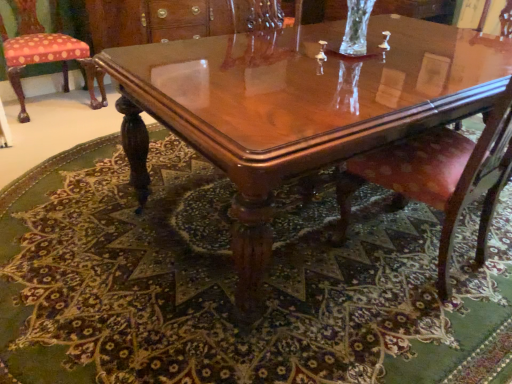
Question: From the image's perspective, is polka dot fabric cushion at left, the 2th chair from the front, beneath pink velvet chair at center, which appears as the 2th chair when viewed from the top?

Choices:
 (A) no
 (B) yes

Answer: (A)

Question: Considering the relative positions of polka dot fabric cushion at left, marked as the 1th chair in a top-to-bottom arrangement, and pink velvet chair at center, which appears as the 2th chair when viewed from the top, in the image provided, is polka dot fabric cushion at left, marked as the 1th chair in a top-to-bottom arrangement, behind pink velvet chair at center, which appears as the 2th chair when viewed from the top,?

Choices:
 (A) yes
 (B) no

Answer: (A)

Question: Is polka dot fabric cushion at left, the 2th chair from the front, taller than pink velvet chair at center, acting as the first chair starting from the front?

Choices:
 (A) no
 (B) yes

Answer: (A)

Question: Is pink velvet chair at center, arranged as the 1th chair when ordered from the bottom, inside polka dot fabric cushion at left, which ranks as the second chair in right-to-left order?

Choices:
 (A) no
 (B) yes

Answer: (A)

Question: Is polka dot fabric cushion at left, which ranks as the second chair in right-to-left order, located outside pink velvet chair at center, arranged as the 1th chair when ordered from the bottom?

Choices:
 (A) yes
 (B) no

Answer: (A)

Question: Is pink velvet chair at center, acting as the second chair starting from the left, wider or thinner than polka dot fabric cushion at left, which appears as the 2th chair when ordered from the bottom?

Choices:
 (A) wide
 (B) thin

Answer: (A)

Question: Is pink velvet chair at center, placed as the second chair when sorted from back to front, inside the boundaries of polka dot fabric cushion at left, the 2th chair from the front, or outside?

Choices:
 (A) inside
 (B) outside

Answer: (B)

Question: Is pink velvet chair at center, placed as the second chair when sorted from back to front, in front of or behind polka dot fabric cushion at left, the 1th chair in the back-to-front sequence, in the image?

Choices:
 (A) front
 (B) behind

Answer: (A)

Question: Based on their sizes in the image, would you say pink velvet chair at center, acting as the first chair starting from the front, is bigger or smaller than polka dot fabric cushion at left, the 1th chair in the back-to-front sequence?

Choices:
 (A) small
 (B) big

Answer: (B)

Question: Looking at the image, does carpeted floor at center seem bigger or smaller compared to polka dot fabric cushion at left, marked as the 1th chair in a top-to-bottom arrangement?

Choices:
 (A) small
 (B) big

Answer: (B)

Question: From the image's perspective, relative to polka dot fabric cushion at left, the 2th chair from the front, is carpeted floor at center above or below?

Choices:
 (A) above
 (B) below

Answer: (B)

Question: Is carpeted floor at center in front of or behind polka dot fabric cushion at left, which appears as the 2th chair when ordered from the bottom, in the image?

Choices:
 (A) front
 (B) behind

Answer: (A)

Question: Do you think carpeted floor at center is within polka dot fabric cushion at left, which appears as the 2th chair when ordered from the bottom, or outside of it?

Choices:
 (A) outside
 (B) inside

Answer: (A)

Question: Considering their positions, is polka dot fabric cushion at left, the 2th chair from the front, located in front of or behind carpeted floor at center?

Choices:
 (A) front
 (B) behind

Answer: (B)

Question: Is polka dot fabric cushion at left, the 2th chair from the front, spatially inside carpeted floor at center, or outside of it?

Choices:
 (A) inside
 (B) outside

Answer: (B)